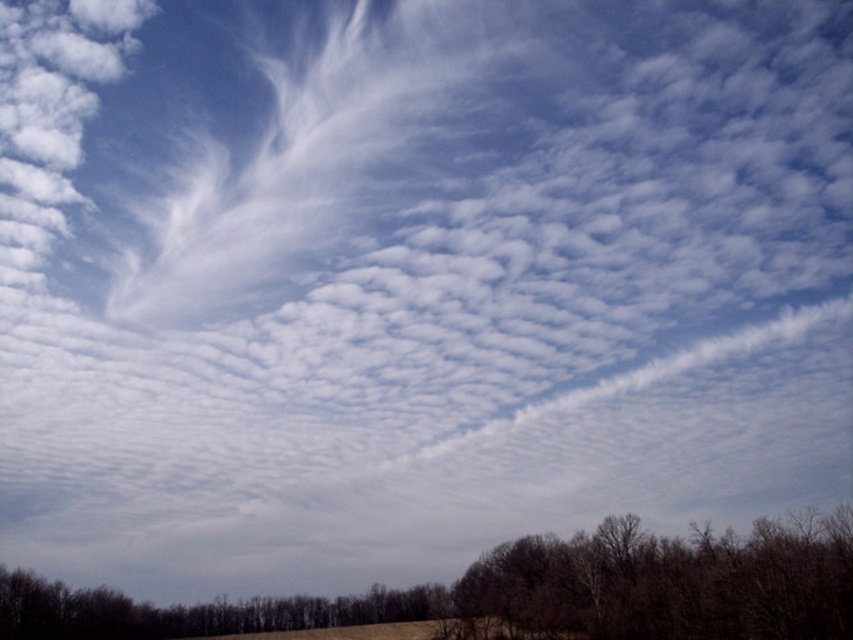
You are standing in a forest looking at the scene. There is a point marked at coordinates point (525, 593). Based on the description, where is this point located in relation to the brown leafless trees at lower center?

The point (525, 593) is located on the brown leafless trees at lower center.

You are standing in a field looking at the brown leafless trees at lower center and the brown matte tree at lower right. Which tree is taller?

The brown leafless trees at lower center is taller than the brown matte tree at lower right.

You are standing in a field looking at the scene. You see two points in the sky, one at coordinates point (814, 598) and the other at point (764, 536). Which point is closer to you?

Point (814, 598) is in front of point (764, 536), so it is closer to you.